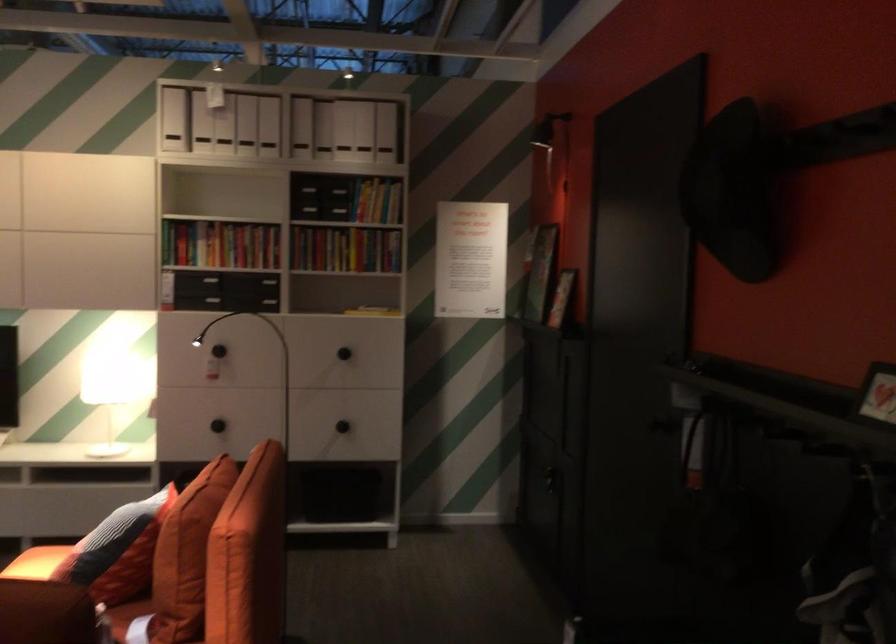
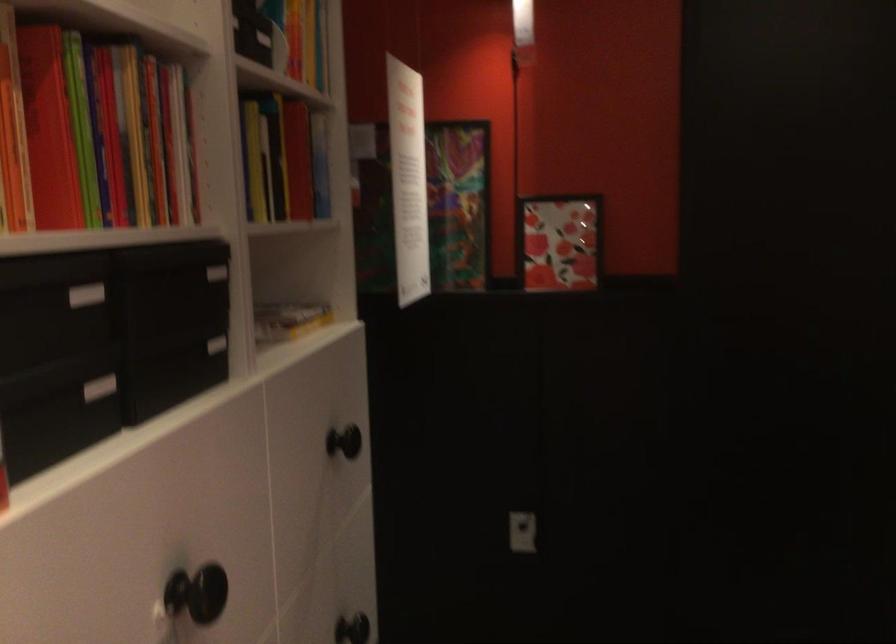
The point at (x=257, y=270) is marked in the first image. Where is the corresponding point in the second image?

(216, 272)